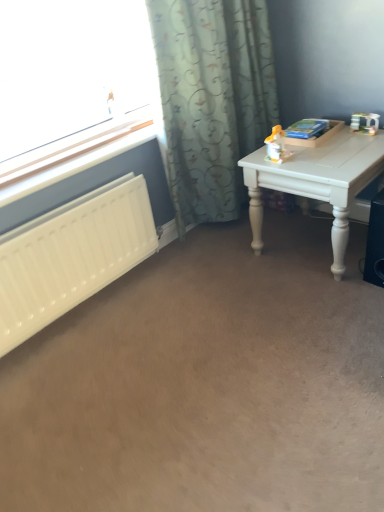
Question: Should I look upward or downward to see yellow plastic toy at upper right?

Choices:
 (A) up
 (B) down

Answer: (A)

Question: Is the surface of yellow plastic toy at upper right in direct contact with white painted wood table at right?

Choices:
 (A) yes
 (B) no

Answer: (B)

Question: Does yellow plastic toy at upper right appear on the left side of white painted wood table at right?

Choices:
 (A) no
 (B) yes

Answer: (B)

Question: Is yellow plastic toy at upper right facing towards white painted wood table at right?

Choices:
 (A) yes
 (B) no

Answer: (B)

Question: From the image's perspective, does yellow plastic toy at upper right appear higher than white painted wood table at right?

Choices:
 (A) yes
 (B) no

Answer: (A)

Question: Is yellow plastic toy at upper right oriented away from white painted wood table at right?

Choices:
 (A) yes
 (B) no

Answer: (B)

Question: From a real-world perspective, is yellow plastic toy at upper right physically above white painted wood table at right?

Choices:
 (A) yes
 (B) no

Answer: (A)

Question: From the image's perspective, would you say patterned fabric curtain at upper center is shown under white plastic radiator at left?

Choices:
 (A) yes
 (B) no

Answer: (B)

Question: Is patterned fabric curtain at upper center to the left of white plastic radiator at left from the viewer's perspective?

Choices:
 (A) yes
 (B) no

Answer: (B)

Question: Is patterned fabric curtain at upper center bigger than white plastic radiator at left?

Choices:
 (A) no
 (B) yes

Answer: (B)

Question: Considering the relative sizes of patterned fabric curtain at upper center and white plastic radiator at left in the image provided, is patterned fabric curtain at upper center taller than white plastic radiator at left?

Choices:
 (A) yes
 (B) no

Answer: (A)

Question: From the image's perspective, is patterned fabric curtain at upper center on white plastic radiator at left?

Choices:
 (A) yes
 (B) no

Answer: (A)

Question: Is patterned fabric curtain at upper center wider than white plastic radiator at left?

Choices:
 (A) yes
 (B) no

Answer: (A)

Question: Is white plastic radiator at left facing away from yellow plastic toy at upper right?

Choices:
 (A) no
 (B) yes

Answer: (A)